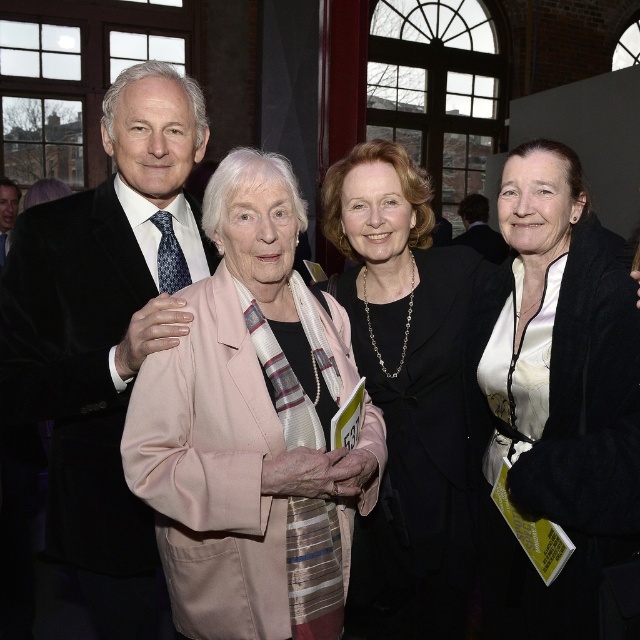
You are a photographer setting up for a group photo. You need to ensure that the velvet black suit at upper left and the white silk blouse at center are both visible in the frame. Given their sizes, which object requires more space horizontally in the photo?

The velvet black suit at upper left requires more space horizontally in the photo because its width is larger than the white silk blouse at center.

You are a photographer adjusting the camera settings to ensure all subjects are in focus. Since the pink satin blazer at center and the matte black suit at left are at different heights, which one should you focus on first to capture both clearly?

The pink satin blazer at center has a greater height compared to the matte black suit at left, so you should focus on the taller pink satin blazer at center first to ensure both are in focus.

You are a photographer standing at the far end of the room. You need to take a photo of both the pink satin blazer at center and the matte black suit at left. Considering their distance, will you be able to capture both in a single frame without moving the camera?

The pink satin blazer at center is 5.44 meters away from the matte black suit at left. Since they are positioned at a distance from each other but within the same general area of the room, a standard camera lens should be able to capture both in a single frame without needing to move the camera.